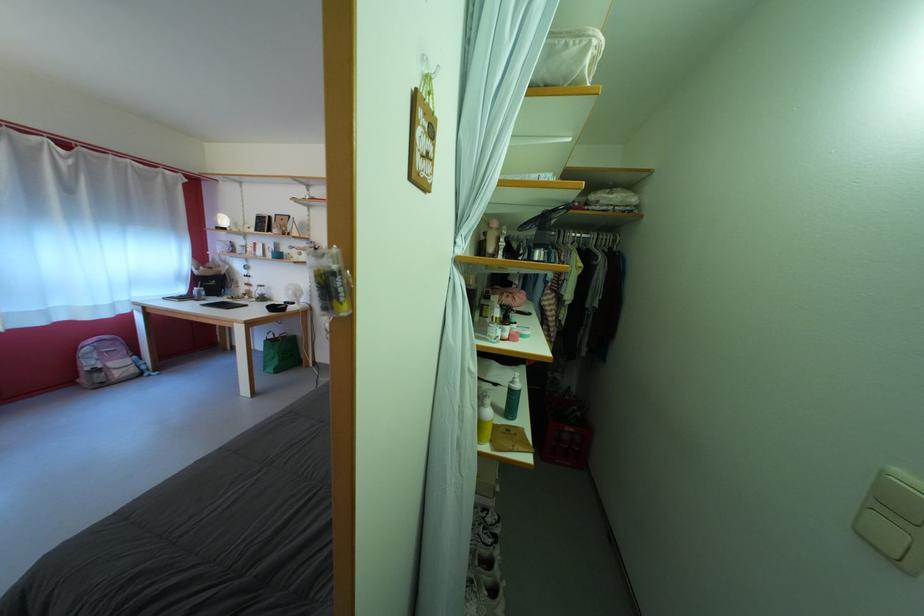
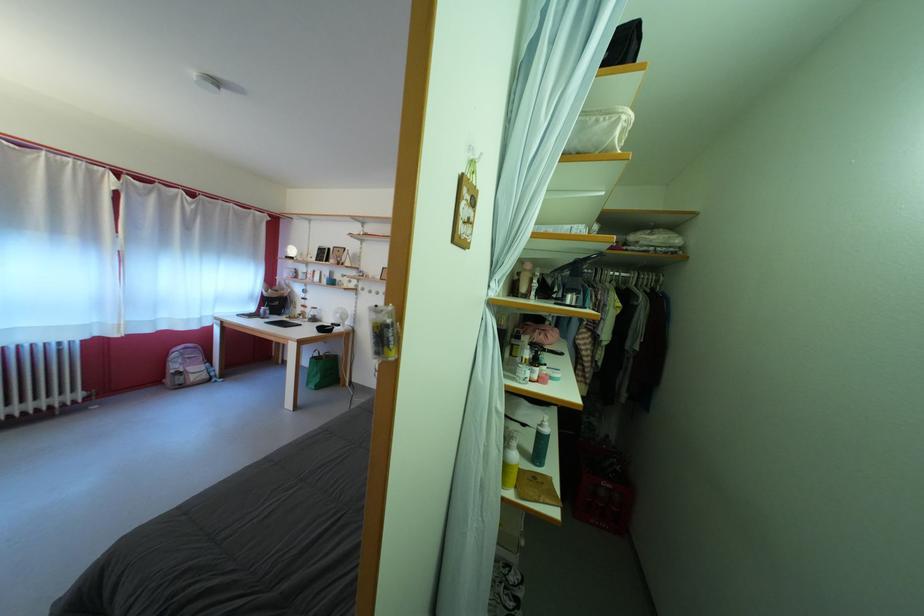
Locate, in the second image, the point that corresponds to the point at 327,290 in the first image.

(383, 339)